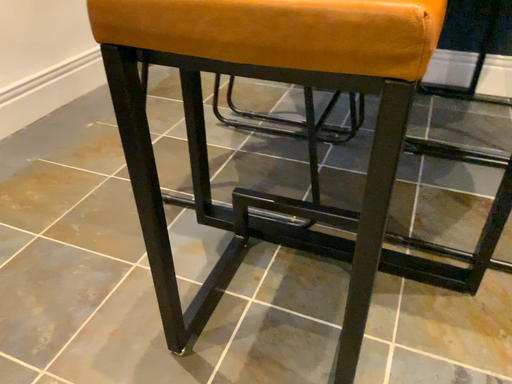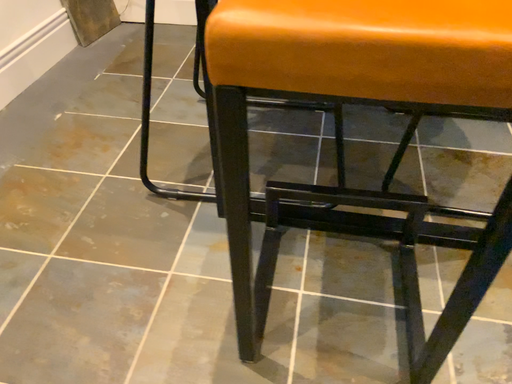
Question: How did the camera likely rotate when shooting the video?

Choices:
 (A) rotated upward
 (B) rotated downward

Answer: (B)